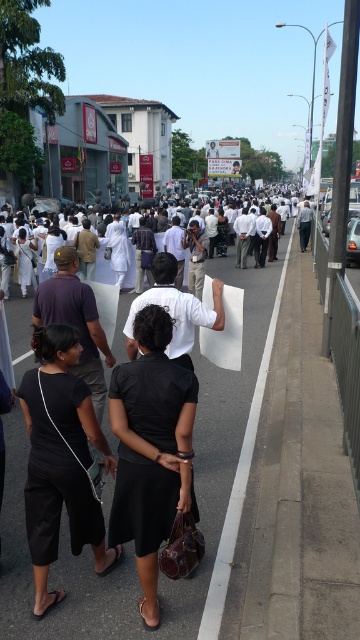
You are standing at the origin point in the image. Where is the asphalt pavement at center located in terms of coordinates?

The asphalt pavement at center is located at coordinates point (221,438).

You are standing at the origin point of the image coordinate system. The image coordinate system has its origin at the bottom left corner. You want to locate the black matte pants at lower left. What are their coordinates?

The coordinates of the black matte pants at lower left are at point (60,460).